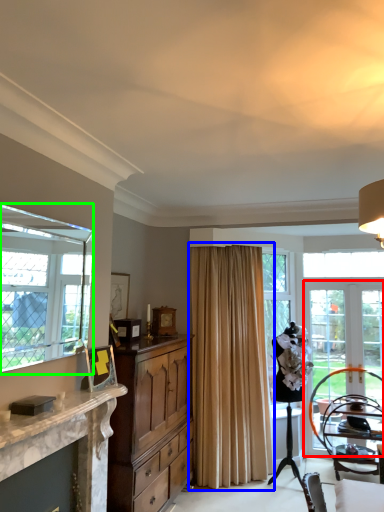
Question: Which is farther away from screen door (highlighted by a red box)? curtain (highlighted by a blue box) or window (highlighted by a green box)?

Choices:
 (A) curtain
 (B) window

Answer: (B)